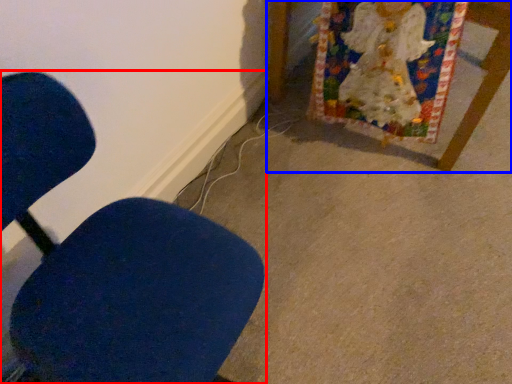
Question: Which of the following is the farthest to the observer, chair (highlighted by a red box) or furniture (highlighted by a blue box)?

Choices:
 (A) chair
 (B) furniture

Answer: (B)